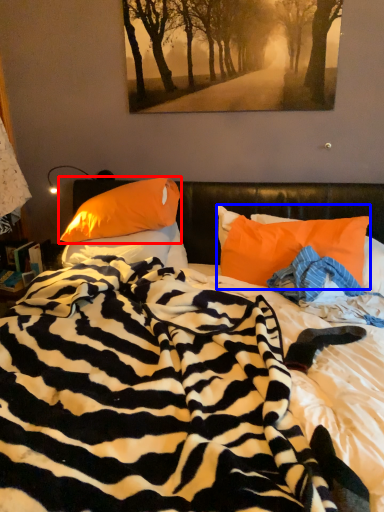
Question: Among these objects, which one is nearest to the camera, pillow (highlighted by a red box) or pillow (highlighted by a blue box)?

Choices:
 (A) pillow
 (B) pillow

Answer: (B)